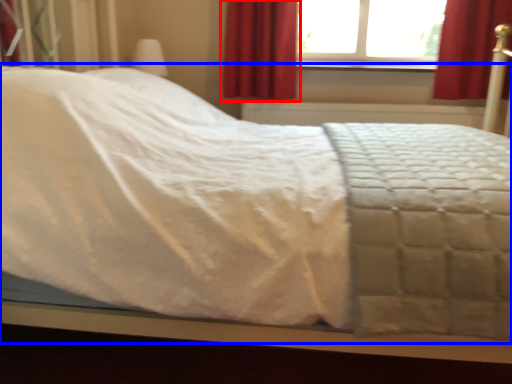
Question: Which object appears closest to the camera in this image, curtain (highlighted by a red box) or bed (highlighted by a blue box)?

Choices:
 (A) curtain
 (B) bed

Answer: (B)